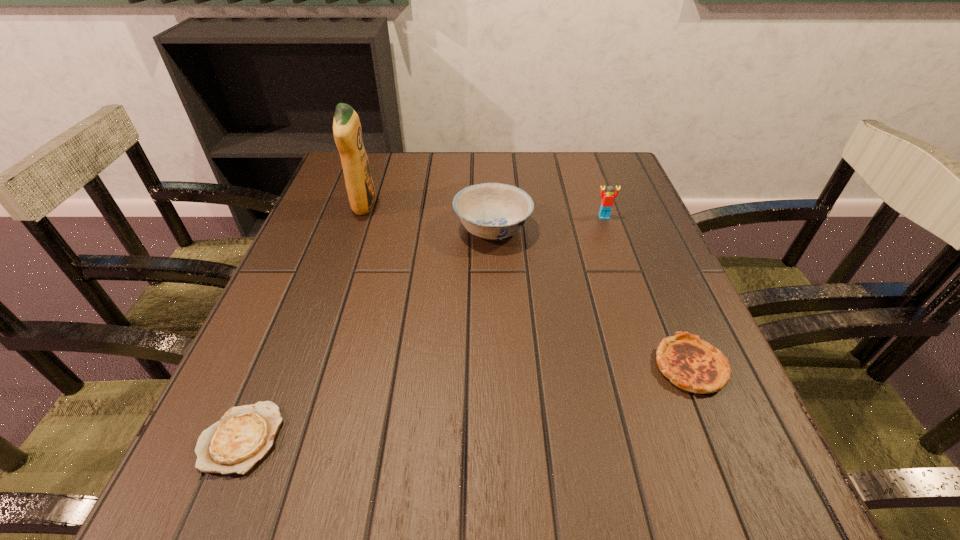
The width and height of the screenshot is (960, 540). Find the location of `detergent`. detergent is located at coordinates point(347,131).

At what (x,y) coordinates should I click in order to perform the action: click on Lego. Please return your answer as a coordinate pair (x, y). Looking at the image, I should click on (607, 198).

Locate an element on the screen. bowl is located at coordinates (494, 211).

Identify the location of the right quiche. (694, 365).

Find the location of `the fourth tallest object`. the fourth tallest object is located at coordinates (694, 365).

The height and width of the screenshot is (540, 960). Find the location of `the nearer quiche`. the nearer quiche is located at coordinates (245, 434).

You are a GUI agent. You are given a task and a screenshot of the screen. Output one action in this format:
    pyautogui.click(x=<x>, y=<y>)
    Task: Click on the shortest object
    Image resolution: width=960 pixels, height=540 pixels.
    Given the screenshot: What is the action you would take?
    pyautogui.click(x=245, y=434)

Where is `vacant area situated 0.270m on the label of the detergent`? Image resolution: width=960 pixels, height=540 pixels. vacant area situated 0.270m on the label of the detergent is located at coordinates (487, 206).

Where is `vacant space located on the face of the Lego`? vacant space located on the face of the Lego is located at coordinates (628, 285).

This screenshot has width=960, height=540. In order to click on vacant space located 0.320m on the left of the third object from right to left in this screenshot , I will do (x=313, y=228).